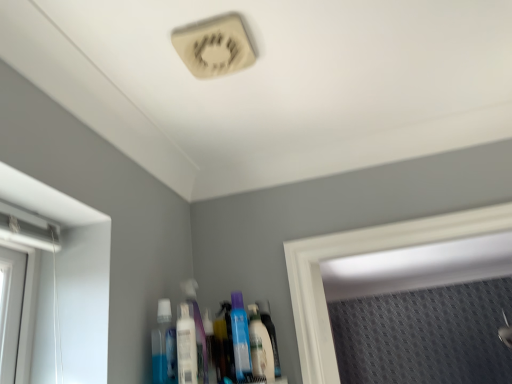
Question: Is blue translucent bottle at lower center, which ranks as the 3th mouthwash in right-to-left order, oriented towards white plastic mouthwash at center, placed as the 2th mouthwash when sorted from left to right?

Choices:
 (A) no
 (B) yes

Answer: (B)

Question: From the image's perspective, is blue translucent bottle at lower center, which is the 1th mouthwash in left-to-right order, beneath white plastic mouthwash at center, placed as the 2th mouthwash when sorted from left to right?

Choices:
 (A) no
 (B) yes

Answer: (B)

Question: Is blue translucent bottle at lower center, which is the 1th mouthwash in left-to-right order, beside white plastic mouthwash at center, placed as the 2th mouthwash when sorted from left to right?

Choices:
 (A) no
 (B) yes

Answer: (B)

Question: From a real-world perspective, is blue translucent bottle at lower center, which is the 1th mouthwash in left-to-right order, located higher than white plastic mouthwash at center, placed as the 2th mouthwash when sorted from left to right?

Choices:
 (A) no
 (B) yes

Answer: (B)

Question: Does blue translucent bottle at lower center, which is the 1th mouthwash in left-to-right order, have a smaller size compared to white plastic mouthwash at center, the 2th mouthwash viewed from the right?

Choices:
 (A) yes
 (B) no

Answer: (A)

Question: From a real-world perspective, is blue translucent bottle at lower center, which ranks as the 3th mouthwash in right-to-left order, physically located above or below translucent plastic bottle at center?

Choices:
 (A) above
 (B) below

Answer: (A)

Question: Is point (164, 354) positioned closer to the camera than point (278, 354)?

Choices:
 (A) closer
 (B) farther

Answer: (A)

Question: Choose the correct answer: Is blue translucent bottle at lower center, which ranks as the 3th mouthwash in right-to-left order, inside translucent plastic bottle at center or outside it?

Choices:
 (A) inside
 (B) outside

Answer: (B)

Question: From the image's perspective, is blue translucent bottle at lower center, which ranks as the 3th mouthwash in right-to-left order, above or below translucent plastic bottle at center?

Choices:
 (A) above
 (B) below

Answer: (A)

Question: Is blue translucent bottle at lower center, which ranks as the 3th mouthwash in right-to-left order, taller or shorter than white plastic mouthwash at center, placed as the 2th mouthwash when sorted from left to right?

Choices:
 (A) short
 (B) tall

Answer: (B)

Question: Is point (166, 365) positioned closer to the camera than point (194, 365)?

Choices:
 (A) closer
 (B) farther

Answer: (B)

Question: Considering the relative positions of blue translucent bottle at lower center, which is the 1th mouthwash in left-to-right order, and white plastic mouthwash at center, placed as the 2th mouthwash when sorted from left to right, in the image provided, is blue translucent bottle at lower center, which is the 1th mouthwash in left-to-right order, to the left or to the right of white plastic mouthwash at center, placed as the 2th mouthwash when sorted from left to right,?

Choices:
 (A) right
 (B) left

Answer: (B)

Question: Relative to white plastic mouthwash at center, the 2th mouthwash viewed from the right, is blue translucent bottle at lower center, which ranks as the 3th mouthwash in right-to-left order, in front or behind?

Choices:
 (A) front
 (B) behind

Answer: (B)

Question: Considering the positions of translucent plastic bottle at center and white glossy mouthwash at lower center, the 1th mouthwash when ordered from right to left, in the image, is translucent plastic bottle at center bigger or smaller than white glossy mouthwash at lower center, the 1th mouthwash when ordered from right to left,?

Choices:
 (A) small
 (B) big

Answer: (A)

Question: From a real-world perspective, is translucent plastic bottle at center positioned above or below white glossy mouthwash at lower center, the 1th mouthwash when ordered from right to left?

Choices:
 (A) below
 (B) above

Answer: (B)